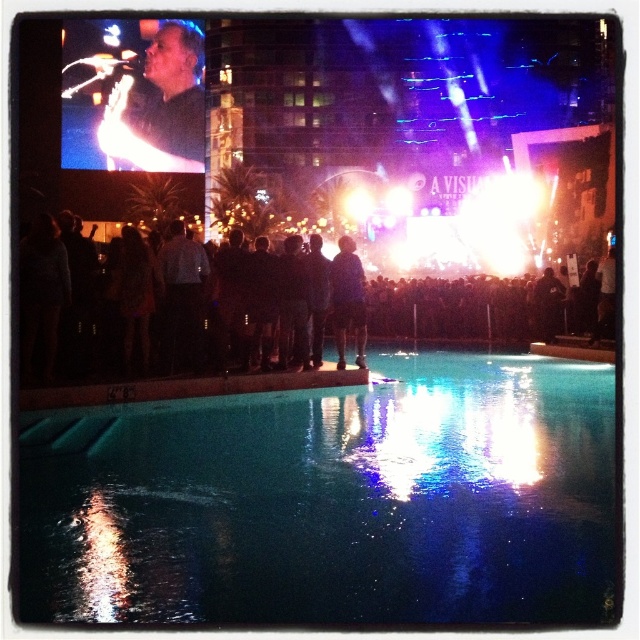
Question: Does clear glass pool at lower center have a smaller size compared to black fabric crowd at center?

Choices:
 (A) no
 (B) yes

Answer: (B)

Question: Which point is farther to the camera?

Choices:
 (A) clear glass pool at lower center
 (B) black fabric crowd at center
 (C) dark blue fabric at center
 (D) matte black shirt at upper left

Answer: (D)

Question: Which point is farther to the camera?

Choices:
 (A) clear glass pool at lower center
 (B) matte black shirt at upper left
 (C) black fabric crowd at center
 (D) dark blue fabric at center

Answer: (B)

Question: Is clear glass pool at lower center below dark blue fabric at center?

Choices:
 (A) no
 (B) yes

Answer: (B)

Question: Can you confirm if black fabric crowd at center is wider than dark blue fabric at center?

Choices:
 (A) yes
 (B) no

Answer: (A)

Question: Estimate the real-world distances between objects in this image. Which object is closer to the matte black shirt at upper left?

Choices:
 (A) clear glass pool at lower center
 (B) dark blue fabric at center
 (C) black fabric crowd at center

Answer: (C)